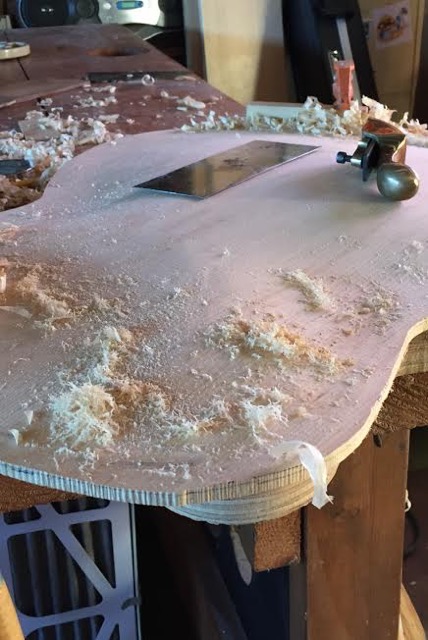
The width and height of the screenshot is (428, 640). Identify the location of hole in table. (119, 51).